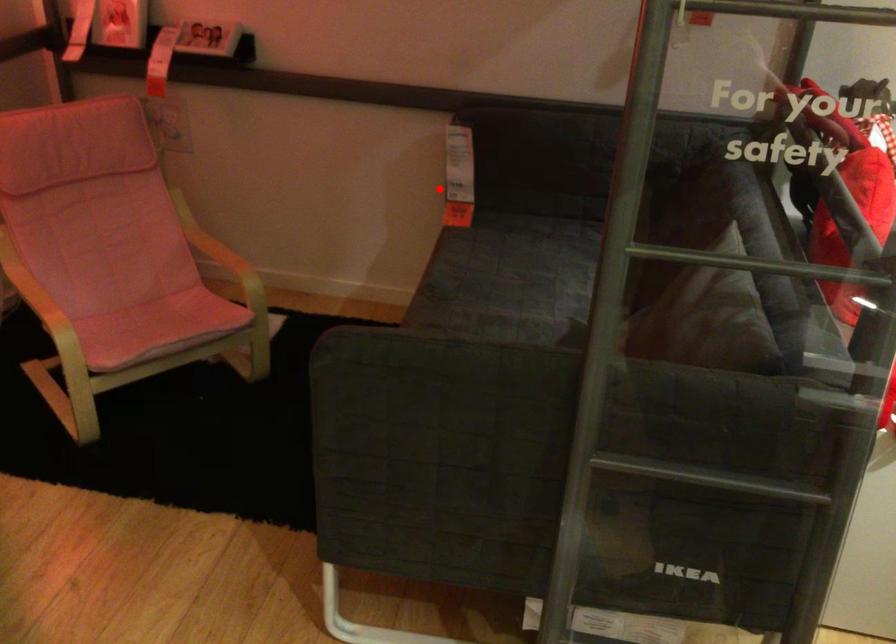
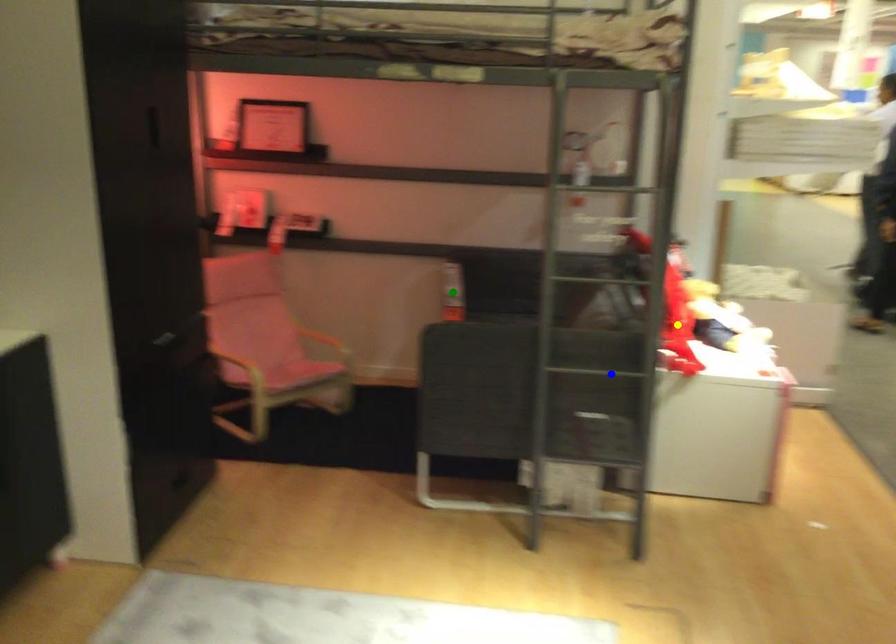
Question: I am providing you with two images of the same scene from different viewpoints. A red point is marked on the first image. You are given multiple points on the second image. Which point in image 2 represents the same 3d spot as the red point in image 1?

Choices:
 (A) yellow point
 (B) green point
 (C) blue point

Answer: (B)